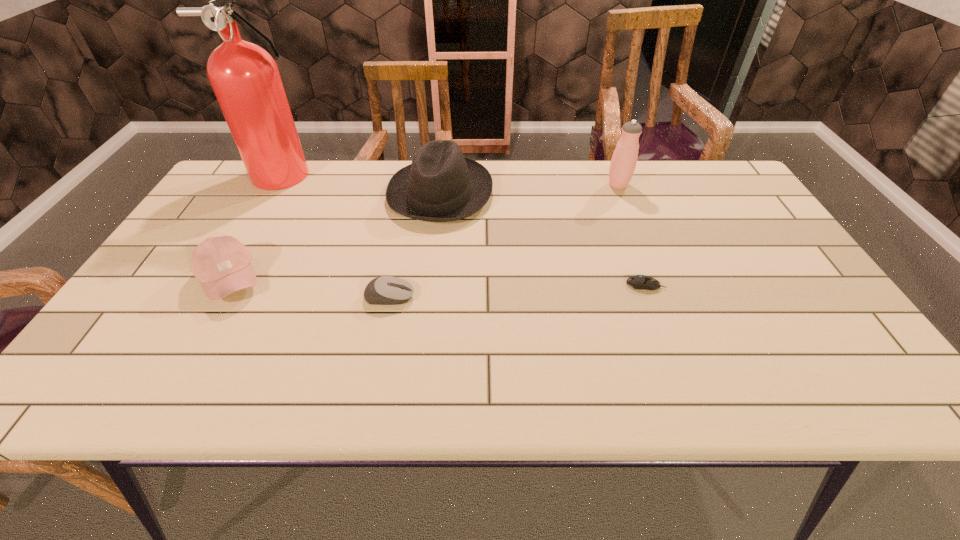
Image resolution: width=960 pixels, height=540 pixels. Find the location of `free spot that satisfies the following two spatial constraints: 1. on the front side of the right computer mouse; 2. on the wheel side of the taller computer mouse`. free spot that satisfies the following two spatial constraints: 1. on the front side of the right computer mouse; 2. on the wheel side of the taller computer mouse is located at coordinates (650, 296).